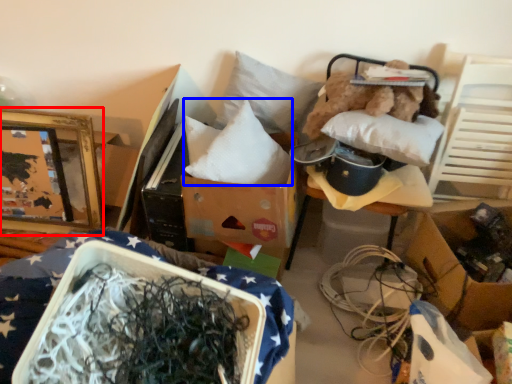
Question: Among these objects, which one is farthest to the camera, picture frame (highlighted by a red box) or pillow (highlighted by a blue box)?

Choices:
 (A) picture frame
 (B) pillow

Answer: (A)